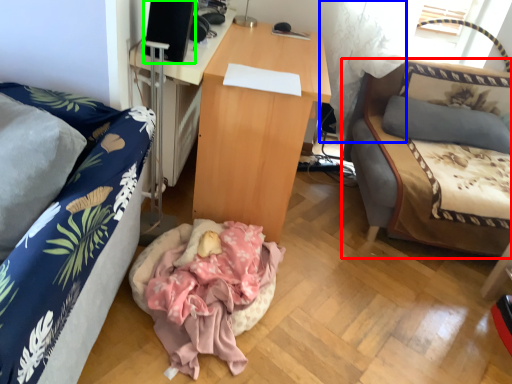
Question: Based on their relative distances, which object is nearer to studio couch (highlighted by a red box)? Choose from curtain (highlighted by a blue box) and speaker (highlighted by a green box).

Choices:
 (A) curtain
 (B) speaker

Answer: (A)